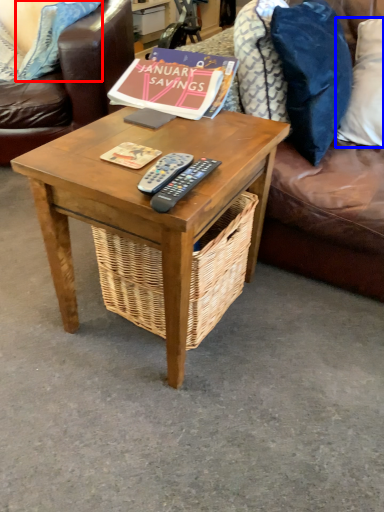
Question: Which object appears closest to the camera in this image, pillow (highlighted by a red box) or pillow (highlighted by a blue box)?

Choices:
 (A) pillow
 (B) pillow

Answer: (B)